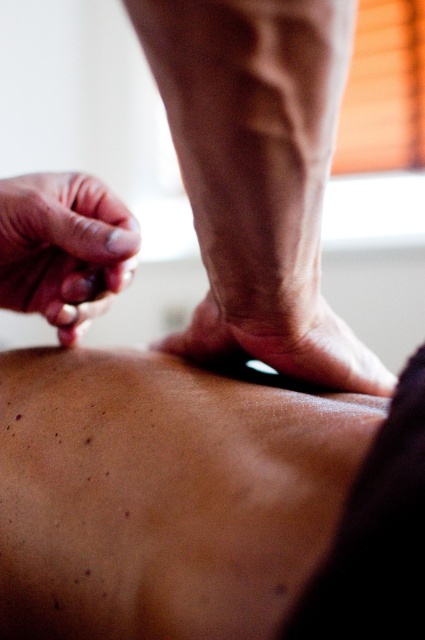
You are a massage therapist assessing the positioning of your hands during a session. You notice the smooth skin at center and the smooth skin hand at upper left. Which object is located below the other?

The smooth skin at center is positioned under the smooth skin hand at upper left.

You are a photographer taking a close up shot of the massage scene. You need to focus on the smooth skin at center and the smooth skin leg at center. Which one should you focus on first to ensure it appears clearer in the photo?

The smooth skin at center should be focused on first because it is closer to the viewer than the smooth skin leg at center, so focusing on it first will ensure it appears clearer in the photo.

You are a photographer trying to capture the best angle of the massage scene. You notice two specific points marked in the image. Which point, point 1 at coordinates point (48, 410) or point 2 at coordinates point (3, 253), is closer to your camera lens?

Point 1 at coordinates point (48, 410) is closer to the viewer than point 2 at coordinates point (3, 253).